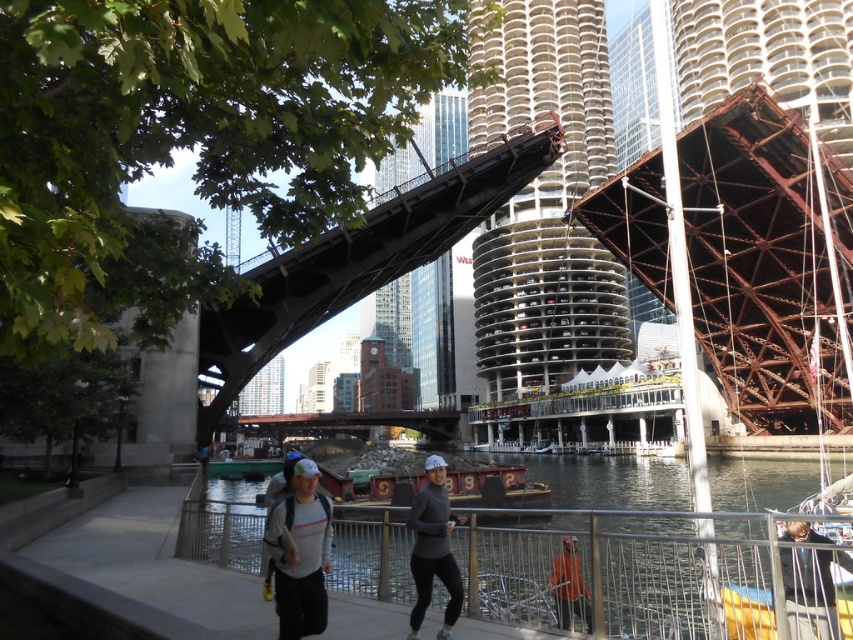
Question: Does black steel bridge at center have a greater width compared to orange fabric at lower right?

Choices:
 (A) yes
 (B) no

Answer: (A)

Question: Is black steel bridge at center to the right of dark gray fabric jacket at lower right from the viewer's perspective?

Choices:
 (A) yes
 (B) no

Answer: (B)

Question: Which point is farther to the camera?

Choices:
 (A) (514, 131)
 (B) (786, 604)
 (C) (306, 584)
 (D) (410, 509)

Answer: (A)

Question: Which of the following is the closest to the observer?

Choices:
 (A) (430, 474)
 (B) (578, 582)
 (C) (440, 628)
 (D) (422, 508)

Answer: (C)

Question: Is matte gray hoodie at center positioned before matte black leggings at center?

Choices:
 (A) no
 (B) yes

Answer: (B)

Question: Which of the following is the closest to the observer?

Choices:
 (A) orange fabric at lower right
 (B) matte gray backpack at center

Answer: (B)